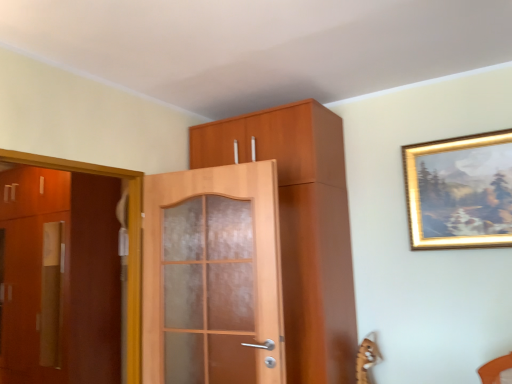
Question: Is matte wood cabinet at center taller than matte brown cabinet at left, the 1th door positioned from the back?

Choices:
 (A) no
 (B) yes

Answer: (A)

Question: From a real-world perspective, is matte wood cabinet at center physically below matte brown cabinet at left, the 1th door positioned from the left?

Choices:
 (A) yes
 (B) no

Answer: (B)

Question: Can you confirm if matte wood cabinet at center is positioned to the left of matte brown cabinet at left, the 1th door positioned from the left?

Choices:
 (A) yes
 (B) no

Answer: (B)

Question: Is the position of matte wood cabinet at center more distant than that of matte brown cabinet at left, the 1th door positioned from the left?

Choices:
 (A) yes
 (B) no

Answer: (B)

Question: Does matte wood cabinet at center lie in front of matte brown cabinet at left, the 1th door positioned from the back?

Choices:
 (A) yes
 (B) no

Answer: (A)

Question: In terms of size, does matte wood cabinet at center appear bigger or smaller than gold-framed painting at upper right?

Choices:
 (A) small
 (B) big

Answer: (B)

Question: Relative to gold-framed painting at upper right, is matte wood cabinet at center in front or behind?

Choices:
 (A) behind
 (B) front

Answer: (B)

Question: Does point (287, 372) appear closer or farther from the camera than point (485, 177)?

Choices:
 (A) farther
 (B) closer

Answer: (B)

Question: Is matte wood cabinet at center situated inside gold-framed painting at upper right or outside?

Choices:
 (A) outside
 (B) inside

Answer: (A)

Question: Looking at the image, does matte brown cabinet at left, marked as the 2th door in a front-to-back arrangement, seem bigger or smaller compared to matte wood cabinet at center?

Choices:
 (A) big
 (B) small

Answer: (A)

Question: Choose the correct answer: Is matte brown cabinet at left, marked as the 2th door in a front-to-back arrangement, inside matte wood cabinet at center or outside it?

Choices:
 (A) outside
 (B) inside

Answer: (A)

Question: Considering the positions of matte brown cabinet at left, the 1th door positioned from the back, and matte wood cabinet at center in the image, is matte brown cabinet at left, the 1th door positioned from the back, wider or thinner than matte wood cabinet at center?

Choices:
 (A) thin
 (B) wide

Answer: (B)

Question: From the image's perspective, is matte brown cabinet at left, the 1th door positioned from the left, located above or below matte wood cabinet at center?

Choices:
 (A) below
 (B) above

Answer: (A)

Question: Is matte wood door at center, positioned as the 1th door in right-to-left order, to the left or to the right of gold-framed painting at upper right in the image?

Choices:
 (A) right
 (B) left

Answer: (B)

Question: Is matte wood door at center, which is counted as the second door, starting from the left, in front of or behind gold-framed painting at upper right in the image?

Choices:
 (A) front
 (B) behind

Answer: (A)